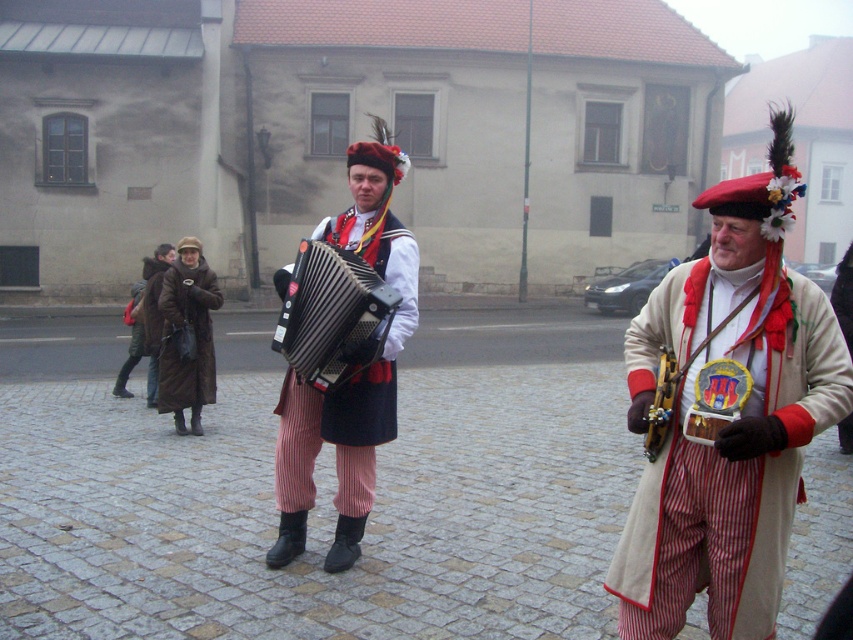
Can you confirm if beige woolen coat at center is positioned to the left of black plastic accordion at center?

In fact, beige woolen coat at center is to the right of black plastic accordion at center.

Is beige woolen coat at center thinner than black plastic accordion at center?

Incorrect, beige woolen coat at center's width is not less than black plastic accordion at center's.

Who is more distant from viewer, (811, 337) or (339, 310)?

The point (339, 310) is behind.

The image size is (853, 640). Identify the location of beige woolen coat at center. [x=724, y=454].

Consider the image. Who is positioned more to the left, black plastic accordion at center or brown leather coat at center?

From the viewer's perspective, brown leather coat at center appears more on the left side.

Where is `black plastic accordion at center`? The width and height of the screenshot is (853, 640). black plastic accordion at center is located at coordinates (331, 314).

Is beige woolen coat at center positioned in front of brown leather coat at center?

Yes, beige woolen coat at center is in front of brown leather coat at center.

Based on the photo, does beige woolen coat at center appear under brown leather coat at center?

Yes, beige woolen coat at center is below brown leather coat at center.

Identify the location of beige woolen coat at center. The width and height of the screenshot is (853, 640). (724, 454).